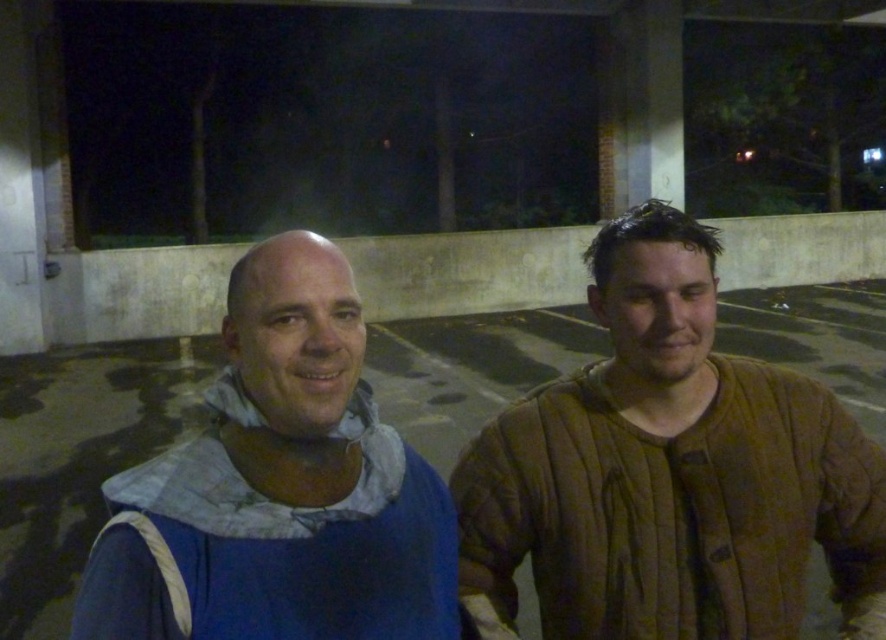
Question: Among these points, which one is farthest from the camera?

Choices:
 (A) (737, 424)
 (B) (226, 342)

Answer: (A)

Question: Among these points, which one is farthest from the camera?

Choices:
 (A) (542, 516)
 (B) (238, 413)

Answer: (A)

Question: Among these objects, which one is nearest to the camera?

Choices:
 (A) brown quilted jacket at right
 (B) blue fabric at left

Answer: (B)

Question: Observing the image, what is the correct spatial positioning of brown quilted jacket at right in reference to blue fabric at left?

Choices:
 (A) above
 (B) below

Answer: (A)

Question: Is brown quilted jacket at right positioned in front of blue fabric at left?

Choices:
 (A) no
 (B) yes

Answer: (A)

Question: Does brown quilted jacket at right come behind blue fabric at left?

Choices:
 (A) yes
 (B) no

Answer: (A)